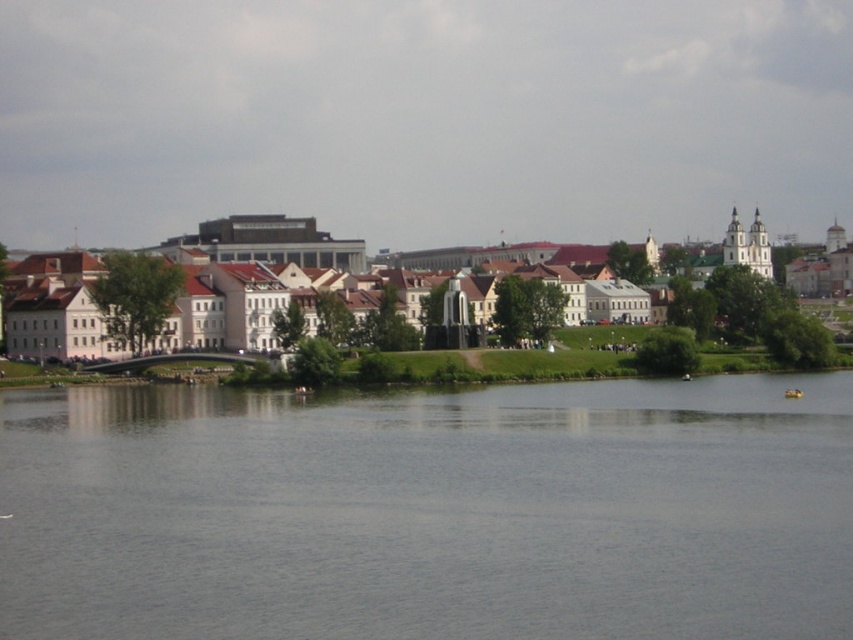
You are a photographer planning to capture the entire scene in one shot. Given that the gray smooth water at center and the white smooth buildings at center are both in the frame, which object appears narrower in the photo?

The gray smooth water at center appears narrower than the white smooth buildings at center in the photo.

You are a tourist standing on the riverside path and want to take a photo of the gray smooth water at center and the white smooth buildings at center. Based on their positions, which object should you frame first in your camera viewfinder to ensure both are captured in the same shot?

Since the gray smooth water at center is to the left of white smooth buildings at center, you should frame the gray smooth water at center first on the left side of the viewfinder and then adjust to include the white smooth buildings at center on the right side to capture both in the same shot.